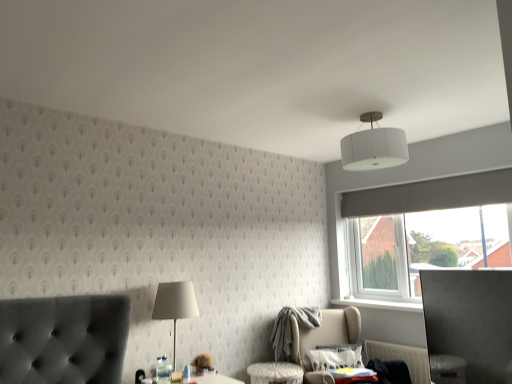
Question: Considering the positions of white ribbed shade at upper center and white plastic radiator at lower right in the image, is white ribbed shade at upper center taller or shorter than white plastic radiator at lower right?

Choices:
 (A) tall
 (B) short

Answer: (A)

Question: Is white ribbed shade at upper center wider or thinner than white plastic radiator at lower right?

Choices:
 (A) wide
 (B) thin

Answer: (A)

Question: Which object is positioned farthest from the white ribbed shade at upper center?

Choices:
 (A) white fabric lampshade at center
 (B) beige fabric swivel chair at lower right
 (C) white plastic radiator at lower right

Answer: (C)

Question: Considering the real-world distances, which object is closest to the beige fabric swivel chair at lower right?

Choices:
 (A) white fabric lampshade at center
 (B) white plastic radiator at lower right
 (C) white ribbed shade at upper center

Answer: (B)